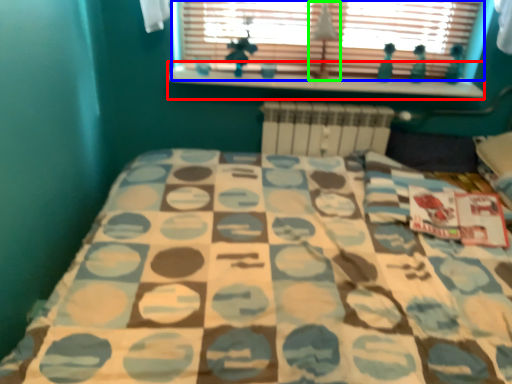
Question: Which is nearer to the window sill (highlighted by a red box)? window (highlighted by a blue box) or lamp (highlighted by a green box).

Choices:
 (A) window
 (B) lamp

Answer: (A)